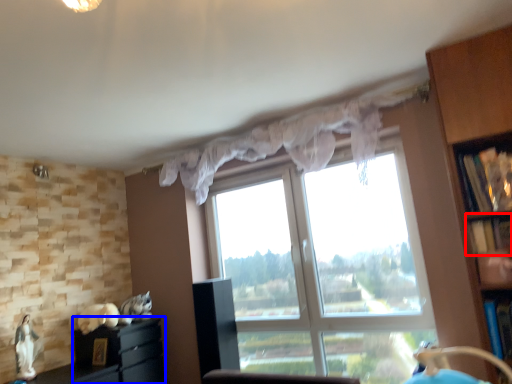
Question: Which point is further to the camera, shelf (highlighted by a red box) or cabinetry (highlighted by a blue box)?

Choices:
 (A) shelf
 (B) cabinetry

Answer: (B)